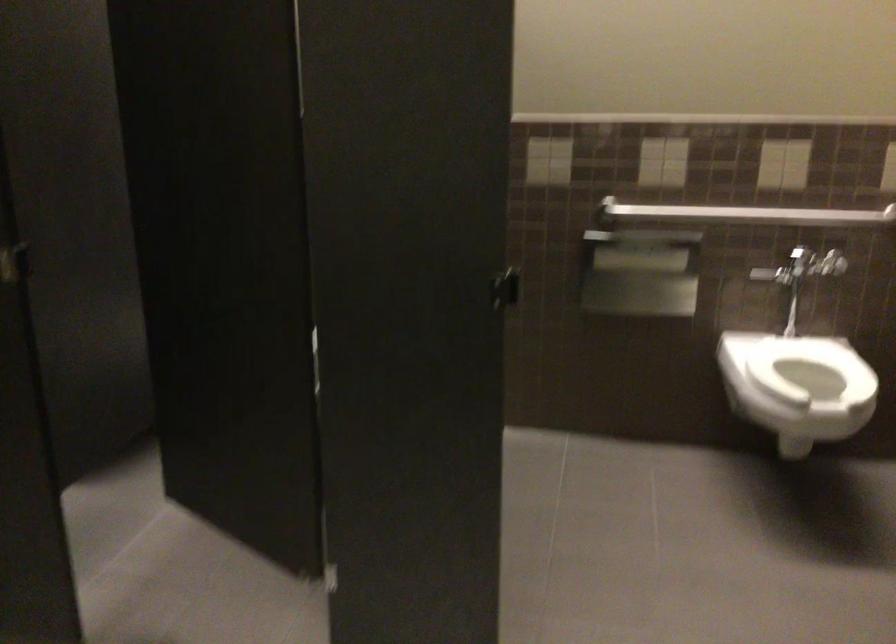
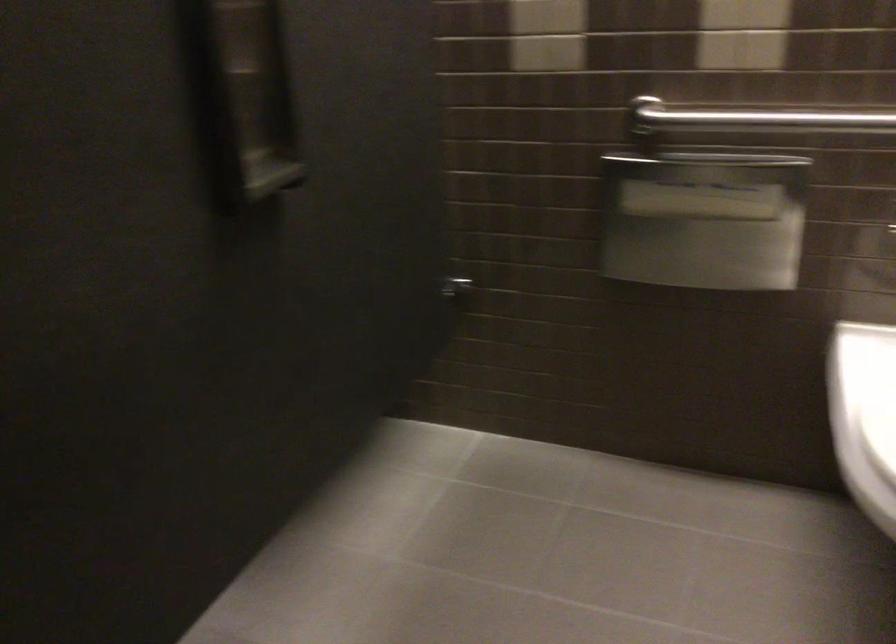
Find the pixel in the second image that matches point 650,270 in the first image.

(703, 220)